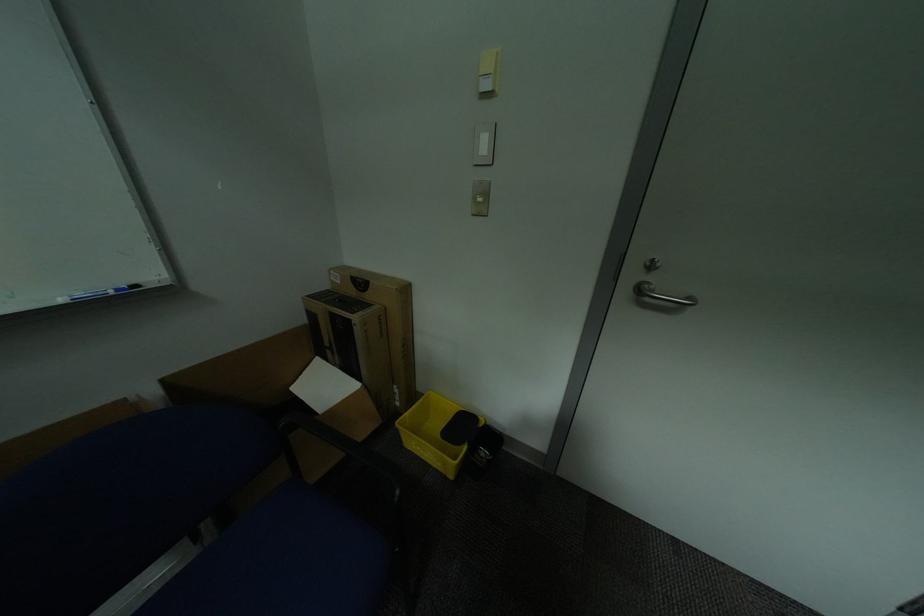
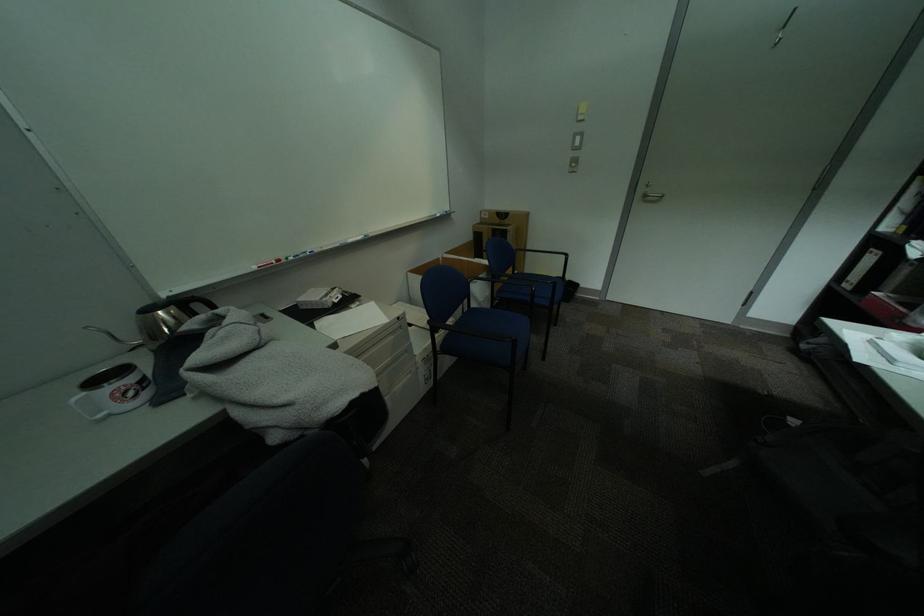
Where in the second image is the point corresponding to point (319, 297) from the first image?

(487, 225)